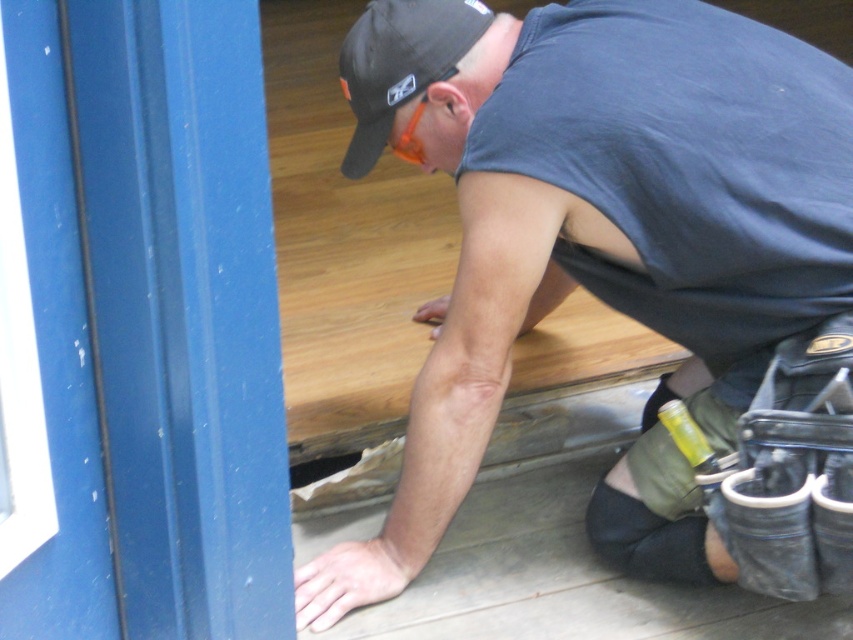
Consider the image. Based on the scene, which object is positioned to the left of the other? The gray fabric construction worker at center or the black fabric baseball cap at upper center?

The black fabric baseball cap at upper center is positioned to the left of the gray fabric construction worker at center.

You are a contractor assessing the dimensions of items in the scene. The matte blue door at left and the black fabric baseball cap at upper center are both visible. Which object has a greater width?

The matte blue door at left has a greater width than the black fabric baseball cap at upper center.

Based on the scene description, can you determine the position of the gray fabric construction worker at center relative to the matte blue door at left?

The gray fabric construction worker at center is positioned to the right of the matte blue door at left.